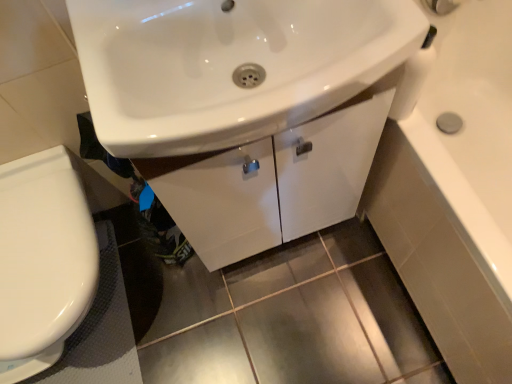
The height and width of the screenshot is (384, 512). In order to click on free space between white glossy cabinet at center and black rubber bath mat at lower left in this screenshot , I will do `click(196, 297)`.